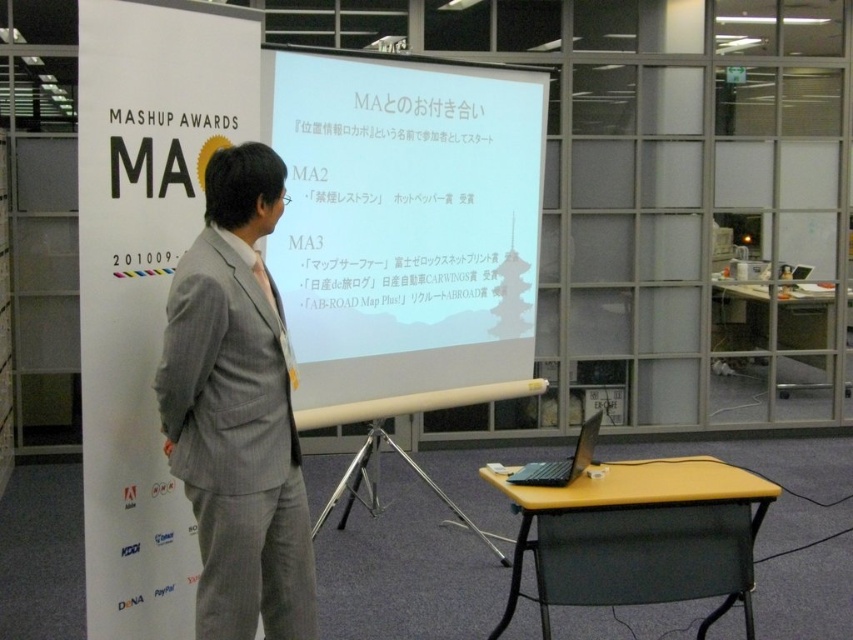
Between gray textured suit at center and black matte laptop at lower right, which one appears on the left side from the viewer's perspective?

Positioned to the left is gray textured suit at center.

Between gray textured suit at center and black matte laptop at lower right, which one appears on the right side from the viewer's perspective?

From the viewer's perspective, black matte laptop at lower right appears more on the right side.

Between point (251, 518) and point (543, 461), which one is positioned behind?

The point (543, 461) is more distant.

The image size is (853, 640). Identify the location of gray textured suit at center. (236, 410).

Does point (492, 236) come farther from viewer compared to point (573, 474)?

Yes, it is behind point (573, 474).

Can you confirm if white matte projector screen at center is shorter than black matte laptop at lower right?

No, white matte projector screen at center is not shorter than black matte laptop at lower right.

Describe the element at coordinates (405, 221) in the screenshot. I see `white matte projector screen at center` at that location.

This screenshot has width=853, height=640. I want to click on white matte projector screen at center, so click(405, 221).

Does white matte projector screen at center lie behind gray textured suit at center?

Yes, it is behind gray textured suit at center.

Does white matte projector screen at center have a larger size compared to gray textured suit at center?

Indeed, white matte projector screen at center has a larger size compared to gray textured suit at center.

The width and height of the screenshot is (853, 640). I want to click on white matte projector screen at center, so click(405, 221).

Identify the location of white matte projector screen at center. Image resolution: width=853 pixels, height=640 pixels. [405, 221].